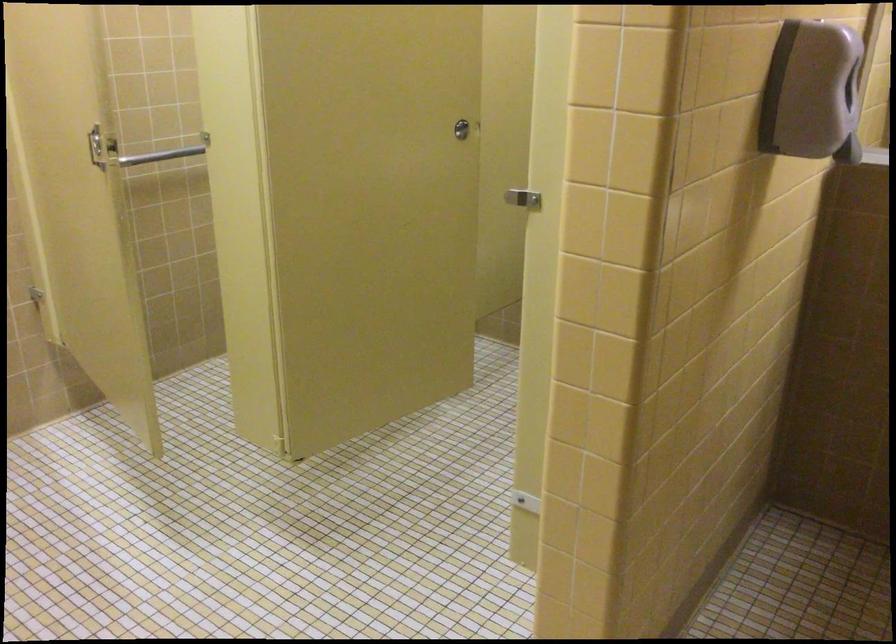
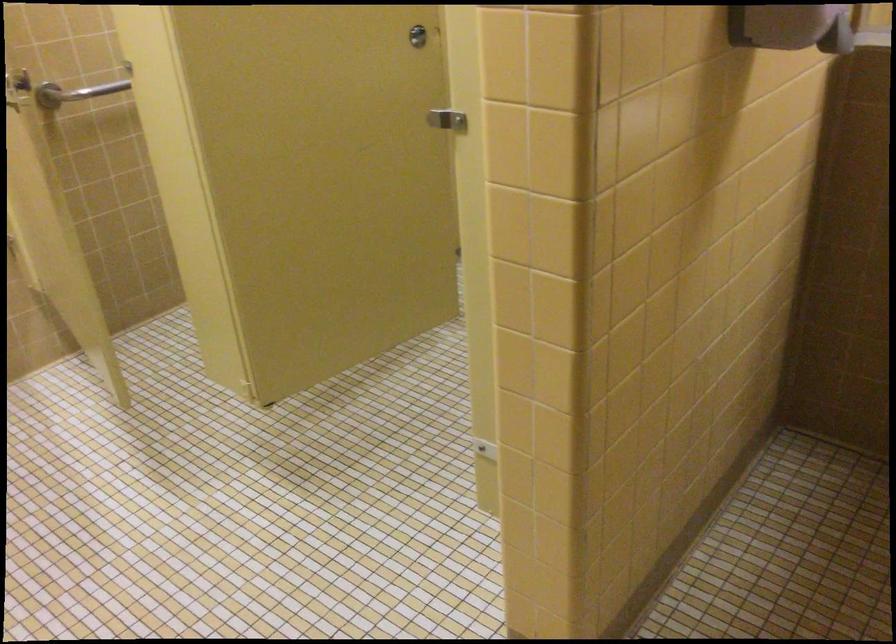
In the second image, find the point that corresponds to (x=117, y=158) in the first image.

(75, 91)